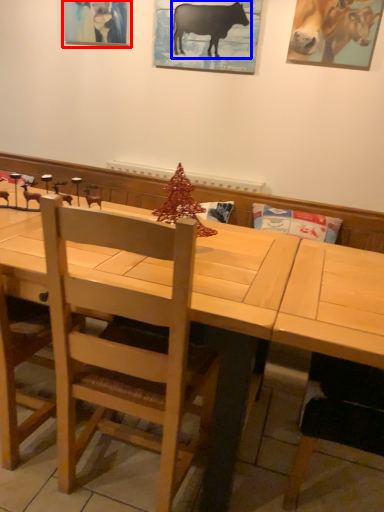
Question: Which object is further to the camera taking this photo, picture frame (highlighted by a red box) or cattle (highlighted by a blue box)?

Choices:
 (A) picture frame
 (B) cattle

Answer: (A)